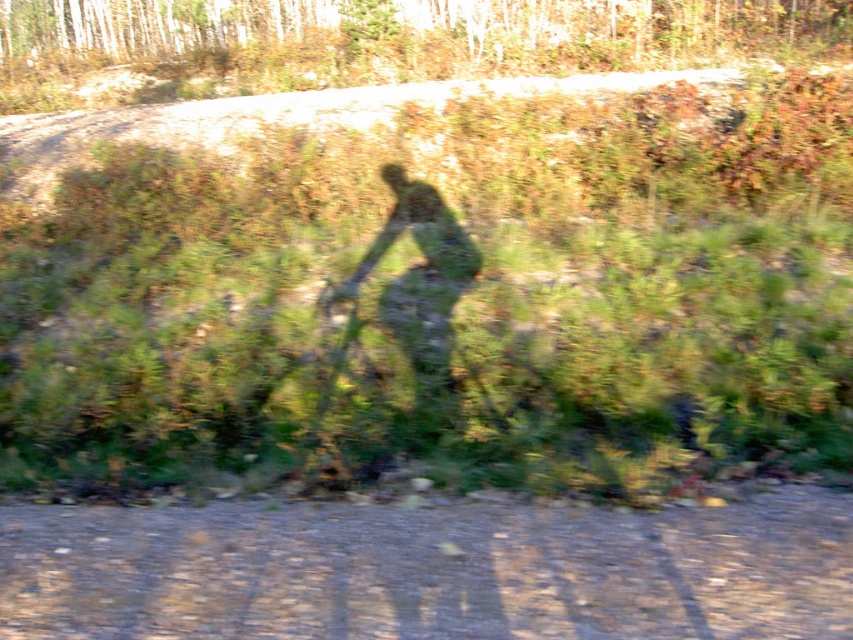
Based on the photo, you are the cyclist in the image and want to reach the point marked as point (614,442). You are currently at point (456,278). Based on the scene description, which direction should you move to get closer to your destination?

Since point (614,442) is in front of point (456,278), you should move forward in the direction you are currently facing to reach your destination.

You are a hiker carrying a backpack and need to cross the brown gravel dirt track at lower center. The green matte figure at center is a cyclist moving towards you. Considering the width of the track compared to the cyclist, can you safely step aside to let them pass without leaving the track?

The brown gravel dirt track at lower center is wider than the green matte figure at center, so there is enough space for you to step aside and let the cyclist pass while remaining on the track.